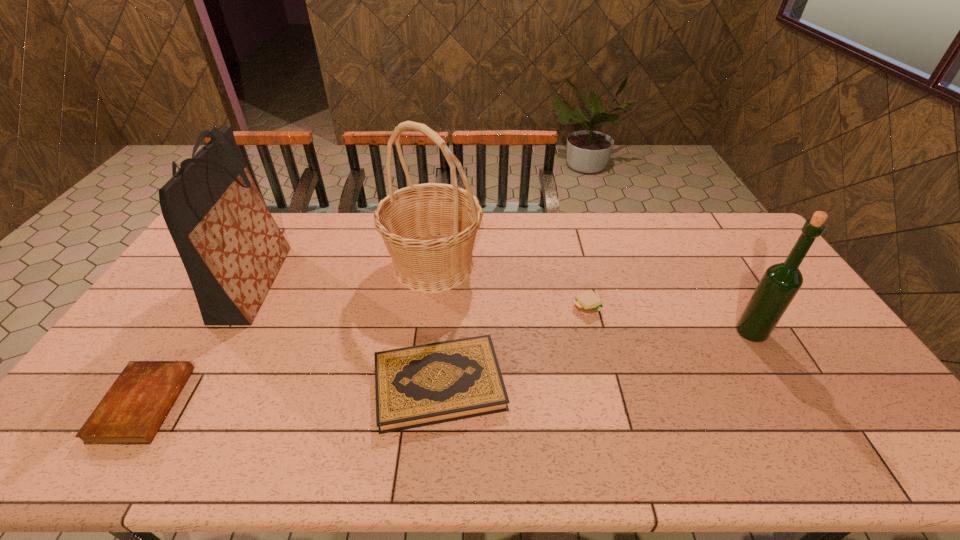
Find the location of `object that is the closest to the Bible`. object that is the closest to the Bible is located at coordinates (232, 249).

Find the location of `the third closest object to the basket`. the third closest object to the basket is located at coordinates (232, 249).

At what (x,y) coordinates should I click in order to perform the action: click on free region that satisfies the following two spatial constraints: 1. on the front side of the basket; 2. on the left side of the hardback book. Please return your answer as a coordinate pair (x, y). Looking at the image, I should click on (420, 384).

Locate an element on the screen. free space that satisfies the following two spatial constraints: 1. on the front side of the basket; 2. on the left side of the patty is located at coordinates (428, 307).

Where is `vacant space that satisfies the following two spatial constraints: 1. on the front-facing side of the shopping bag; 2. on the right side of the second object from right to left`? The width and height of the screenshot is (960, 540). vacant space that satisfies the following two spatial constraints: 1. on the front-facing side of the shopping bag; 2. on the right side of the second object from right to left is located at coordinates (242, 307).

At what (x,y) coordinates should I click in order to perform the action: click on vacant space that satisfies the following two spatial constraints: 1. on the front-facing side of the shopping bag; 2. on the right side of the fifth object from left to right. Please return your answer as a coordinate pair (x, y). The width and height of the screenshot is (960, 540). Looking at the image, I should click on (242, 307).

Where is `vacant point that satisfies the following two spatial constraints: 1. on the front-facing side of the shopping bag; 2. on the left side of the patty`? vacant point that satisfies the following two spatial constraints: 1. on the front-facing side of the shopping bag; 2. on the left side of the patty is located at coordinates click(x=242, y=307).